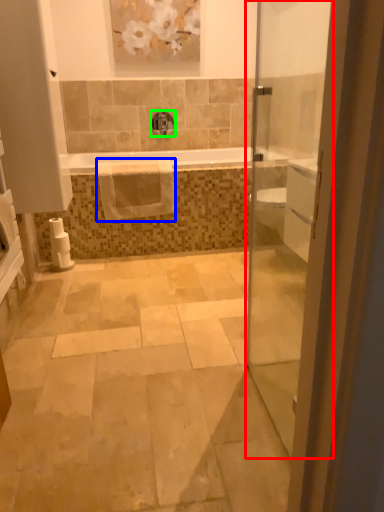
Question: Which is farther away from door (highlighted by a red box)? hand towel (highlighted by a blue box) or tap (highlighted by a green box)?

Choices:
 (A) hand towel
 (B) tap

Answer: (A)